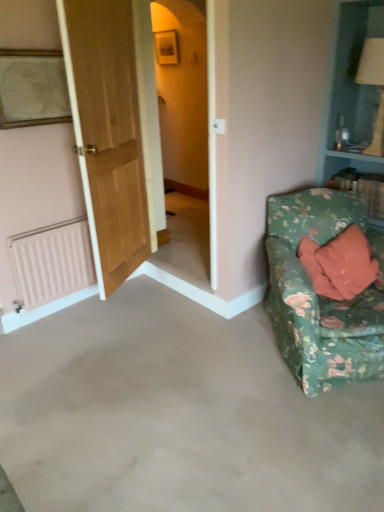
Question: Does floral fabric couch at lower right have a smaller size compared to wooden door at left?

Choices:
 (A) yes
 (B) no

Answer: (B)

Question: Is floral fabric couch at lower right next to wooden door at left?

Choices:
 (A) no
 (B) yes

Answer: (A)

Question: Can you confirm if floral fabric couch at lower right is thinner than wooden door at left?

Choices:
 (A) no
 (B) yes

Answer: (A)

Question: Is floral fabric couch at lower right closer to the viewer compared to wooden door at left?

Choices:
 (A) no
 (B) yes

Answer: (B)

Question: Is wooden door at left inside floral fabric couch at lower right?

Choices:
 (A) yes
 (B) no

Answer: (B)

Question: Can you confirm if floral fabric couch at lower right is taller than wooden door at left?

Choices:
 (A) no
 (B) yes

Answer: (A)

Question: Does floral fabric couch at lower right have a greater height compared to pink matte radiator at lower left?

Choices:
 (A) yes
 (B) no

Answer: (A)

Question: Can you confirm if floral fabric couch at lower right is thinner than pink matte radiator at lower left?

Choices:
 (A) no
 (B) yes

Answer: (A)

Question: From a real-world perspective, is floral fabric couch at lower right over pink matte radiator at lower left?

Choices:
 (A) no
 (B) yes

Answer: (B)

Question: Is floral fabric couch at lower right smaller than pink matte radiator at lower left?

Choices:
 (A) yes
 (B) no

Answer: (B)

Question: Does floral fabric couch at lower right lie in front of pink matte radiator at lower left?

Choices:
 (A) yes
 (B) no

Answer: (A)

Question: Is floral fabric couch at lower right at the right side of pink matte radiator at lower left?

Choices:
 (A) no
 (B) yes

Answer: (B)

Question: Is wooden framed portrait at upper left closer to camera compared to wooden door at left?

Choices:
 (A) yes
 (B) no

Answer: (B)